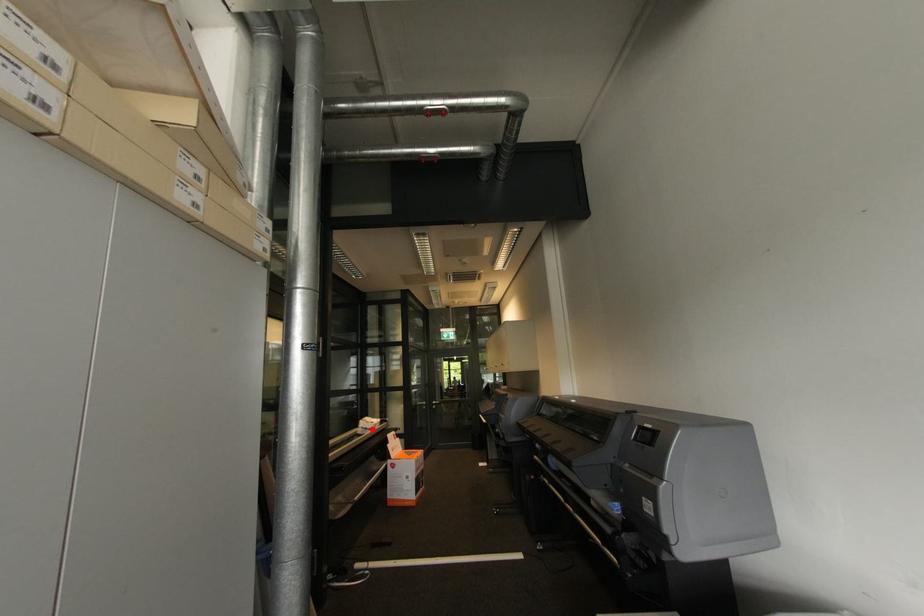
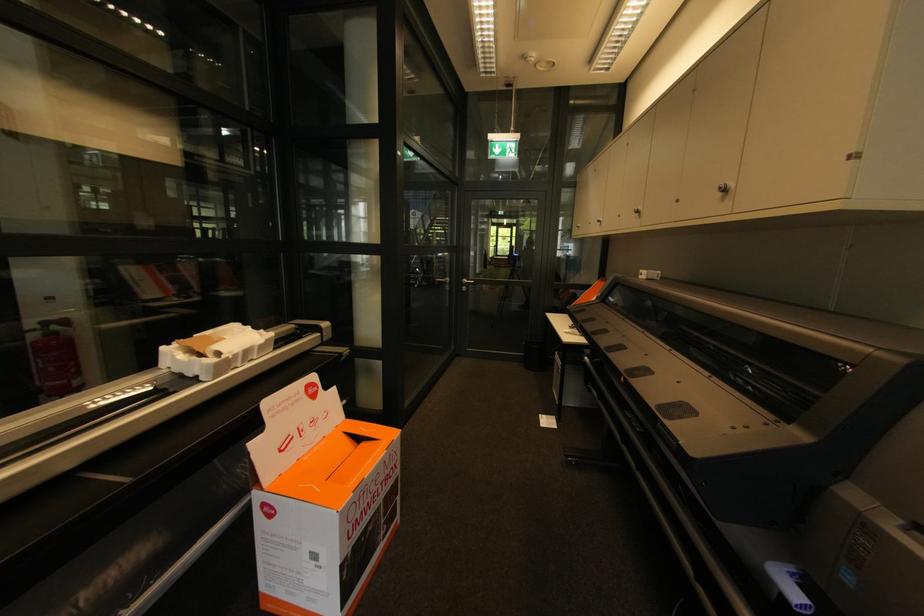
Where in the second image is the point corresponding to the highlighted location from the first image?

(195, 376)